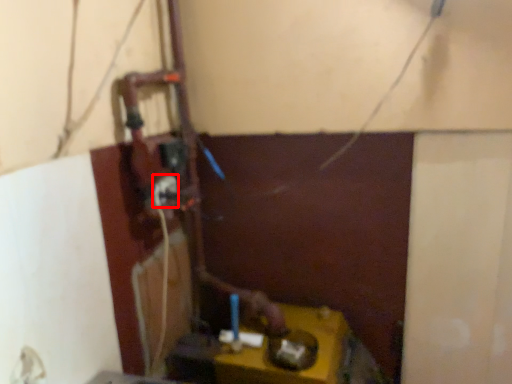
Question: From the image's perspective, what is the correct spatial positioning of power plugs and sockets (annotated by the red box) in reference to table?

Choices:
 (A) above
 (B) below

Answer: (A)